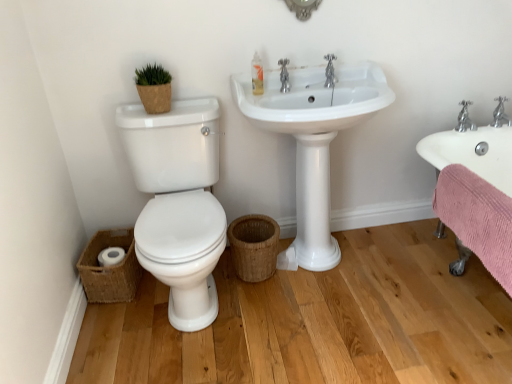
Find the location of `free space to the right of white glossy toilet at left`. free space to the right of white glossy toilet at left is located at coordinates (312, 332).